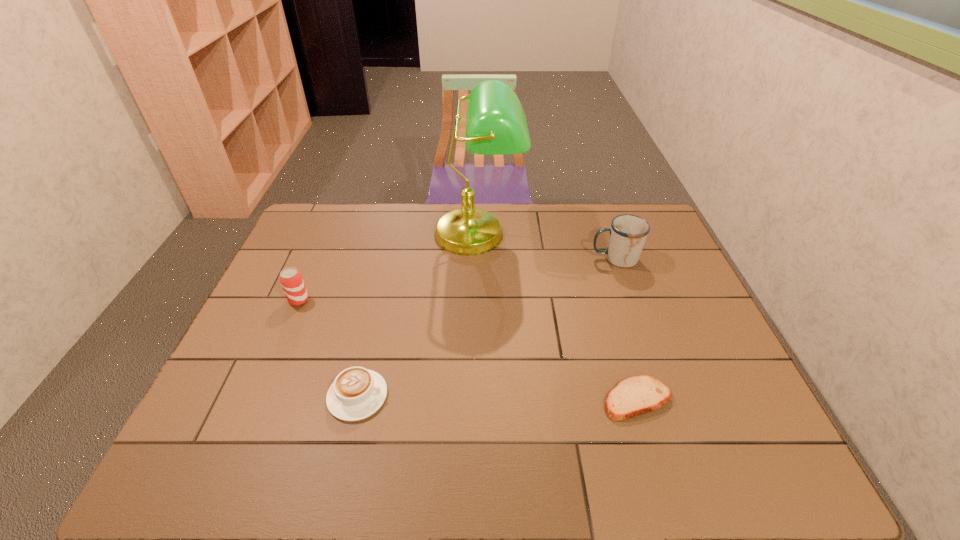
Find the location of `vacant area at the right edge of the desktop`. vacant area at the right edge of the desktop is located at coordinates (657, 270).

In the image, there is a desktop. Identify the location of vacant space at the far left corner. The height and width of the screenshot is (540, 960). (335, 240).

Find the location of a particular element. The width and height of the screenshot is (960, 540). vacant space that is in between the mug and the third shortest object is located at coordinates (457, 280).

At what (x,y) coordinates should I click in order to perform the action: click on blank region between the second object from left to right and the mug. Please return your answer as a coordinate pair (x, y). The image size is (960, 540). Looking at the image, I should click on (487, 327).

Identify the location of free spot between the second tallest object and the leftmost object. (457, 280).

At what (x,y) coordinates should I click in order to perform the action: click on vacant region between the lamp and the leftmost object. Please return your answer as a coordinate pair (x, y). Image resolution: width=960 pixels, height=540 pixels. Looking at the image, I should click on (388, 267).

This screenshot has height=540, width=960. I want to click on free space between the mug and the cappuccino, so click(x=487, y=327).

Identify the location of vacant point located between the cappuccino and the third shortest object. Image resolution: width=960 pixels, height=540 pixels. (328, 348).

I want to click on unoccupied position between the fourth shortest object and the fourth object from right to left, so click(x=487, y=327).

The height and width of the screenshot is (540, 960). Identify the location of free spot between the third nearest object and the mug. (457, 280).